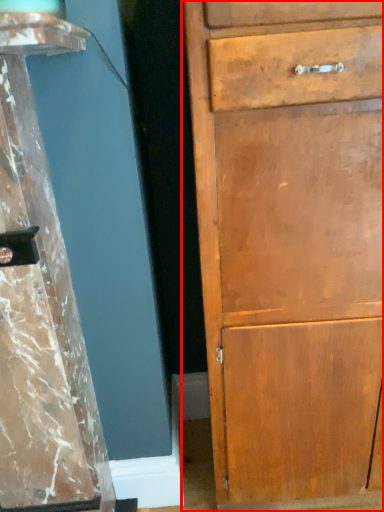
Question: From the image's perspective, where is chest of drawers (annotated by the red box) located relative to pillar?

Choices:
 (A) below
 (B) above

Answer: (B)